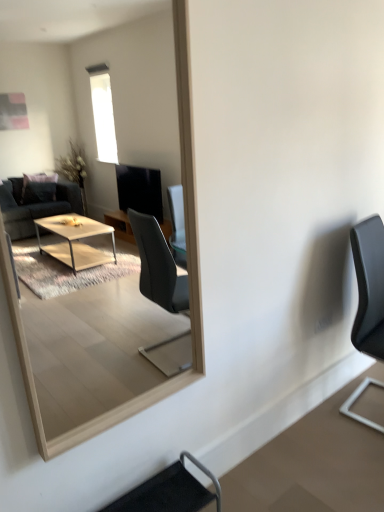
Identify the location of vacant space in black matte chair at right, positioned as the 1th chair in top-to-bottom order (from a real-world perspective). This screenshot has width=384, height=512. (361, 400).